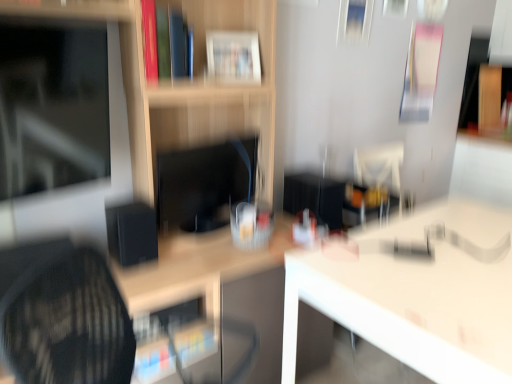
In order to face hardcover book at upper center, the first book in the left-to-right sequence, should I rotate leftwards or rightwards?

Turn left approximately 13.005 degrees to face it.

The width and height of the screenshot is (512, 384). What do you see at coordinates (182, 82) in the screenshot? I see `wooden shelf at center` at bounding box center [182, 82].

What do you see at coordinates (132, 233) in the screenshot?
I see `black matte speaker at center-left` at bounding box center [132, 233].

What do you see at coordinates (234, 56) in the screenshot?
I see `white glossy book at upper center, the 1th book in the right-to-left sequence` at bounding box center [234, 56].

This screenshot has width=512, height=384. I want to click on matte black monitor at left, which is the 2th computer monitor from back to front, so click(61, 131).

You are a GUI agent. You are given a task and a screenshot of the screen. Output one action in this format:
    pyautogui.click(x=<x>, y=<y>)
    Task: Click on the hardcover book at upper center, the first book in the left-to-right sequence
    This screenshot has width=512, height=384.
    Given the screenshot: What is the action you would take?
    pyautogui.click(x=166, y=42)

From the image's perspective, is hardcover book at upper center, arranged as the second book when viewed from the back, located beneath matte black monitor at center, the 1th computer monitor when ordered from right to left?

Actually, hardcover book at upper center, arranged as the second book when viewed from the back, appears above matte black monitor at center, the 1th computer monitor when ordered from right to left, in the image.

Is point (161, 10) farther from viewer compared to point (203, 196)?

No, it is not.

Does hardcover book at upper center, acting as the first book starting from the front, have a lesser height compared to matte black monitor at center, the 1th computer monitor when ordered from right to left?

Yes, hardcover book at upper center, acting as the first book starting from the front, is shorter than matte black monitor at center, the 1th computer monitor when ordered from right to left.

Is hardcover book at upper center, the first book in the left-to-right sequence, facing towards matte black monitor at center, which ranks as the second computer monitor in left-to-right order?

No, hardcover book at upper center, the first book in the left-to-right sequence, is not aimed at matte black monitor at center, which ranks as the second computer monitor in left-to-right order.

Is black matte speaker at center-left at the left side of matte black monitor at center, which ranks as the second computer monitor in left-to-right order?

Correct, you'll find black matte speaker at center-left to the left of matte black monitor at center, which ranks as the second computer monitor in left-to-right order.

Does black matte speaker at center-left come in front of matte black monitor at center, which ranks as the second computer monitor in left-to-right order?

That is False.

Considering the positions of point (140, 250) and point (227, 168), is point (140, 250) closer or farther from the camera than point (227, 168)?

Clearly, point (140, 250) is closer to the camera than point (227, 168).

Consider the image. From a real-world perspective, is black matte speaker at center-left over matte black monitor at center, which is the first computer monitor in back-to-front order?

Incorrect, from a real-world perspective, black matte speaker at center-left is lower than matte black monitor at center, which is the first computer monitor in back-to-front order.

Does white glossy table at center, which appears as the second table when viewed from the left, appear on the left side of black matte speaker at center-left?

No, white glossy table at center, which appears as the second table when viewed from the left, is not to the left of black matte speaker at center-left.

Based on the photo, considering the sizes of objects white glossy table at center, the first table from the right, and black matte speaker at center-left in the image provided, who is bigger, white glossy table at center, the first table from the right, or black matte speaker at center-left?

Bigger between the two is white glossy table at center, the first table from the right.

Is point (442, 228) farther from camera compared to point (155, 248)?

Yes, point (442, 228) is farther from viewer.

Is white glossy table at center, the first table from the right, aimed at black matte speaker at center-left?

No, white glossy table at center, the first table from the right, does not turn towards black matte speaker at center-left.

Is the position of hardcover book at upper center, the first book in the left-to-right sequence, more distant than that of matte black monitor at left, which ranks as the second computer monitor in right-to-left order?

Yes, hardcover book at upper center, the first book in the left-to-right sequence, is further from the camera.

From the image's perspective, who appears lower, hardcover book at upper center, positioned as the second book in right-to-left order, or matte black monitor at left, arranged as the 1th computer monitor when viewed from the left?

matte black monitor at left, arranged as the 1th computer monitor when viewed from the left, from the image's perspective.

Based on the photo, from a real-world perspective, which object stands above the other?

hardcover book at upper center, positioned as the second book in right-to-left order, from a real-world perspective.

Which of these two, hardcover book at upper center, the first book in the left-to-right sequence, or matte black monitor at left, which is the 2th computer monitor from back to front, stands shorter?

With less height is hardcover book at upper center, the first book in the left-to-right sequence.

What's the angular difference between black matte speaker at center-left and wooden shelf at center's facing directions?

The angular difference between black matte speaker at center-left and wooden shelf at center is 5.57 degrees.

From a real-world perspective, is black matte speaker at center-left under wooden shelf at center?

Yes, from a real-world perspective, black matte speaker at center-left is under wooden shelf at center.

Image resolution: width=512 pixels, height=384 pixels. I want to click on shelf in front of the black matte speaker at center-left, so click(x=182, y=82).

Is black matte speaker at center-left taller than wooden shelf at center?

No, black matte speaker at center-left is not taller than wooden shelf at center.

Is black matte speaker at center-left inside the boundaries of matte black monitor at left, which ranks as the second computer monitor in right-to-left order, or outside?

black matte speaker at center-left is outside matte black monitor at left, which ranks as the second computer monitor in right-to-left order.

In the scene shown: Which is in front, black matte speaker at center-left or matte black monitor at left, which is the 2th computer monitor from back to front?

matte black monitor at left, which is the 2th computer monitor from back to front.

Is black matte speaker at center-left bigger or smaller than matte black monitor at left, the 1th computer monitor from the front?

Clearly, black matte speaker at center-left is smaller in size than matte black monitor at left, the 1th computer monitor from the front.

Is black matte speaker at center-left looking in the opposite direction of matte black monitor at left, the 1th computer monitor from the front?

No.

From the image's perspective, is matte black monitor at left, which ranks as the second computer monitor in right-to-left order, located above or below white glossy book at upper center, marked as the 2th book in a left-to-right arrangement?

From the image's perspective, matte black monitor at left, which ranks as the second computer monitor in right-to-left order, appears below white glossy book at upper center, marked as the 2th book in a left-to-right arrangement.

From a real-world perspective, is matte black monitor at left, the 1th computer monitor from the front, located beneath white glossy book at upper center, the 1th book in the right-to-left sequence?

Correct, in the physical world, matte black monitor at left, the 1th computer monitor from the front, is lower than white glossy book at upper center, the 1th book in the right-to-left sequence.

Considering the sizes of objects matte black monitor at left, which is the 2th computer monitor from back to front, and white glossy book at upper center, the 1th book viewed from the back, in the image provided, who is bigger, matte black monitor at left, which is the 2th computer monitor from back to front, or white glossy book at upper center, the 1th book viewed from the back,?

With larger size is matte black monitor at left, which is the 2th computer monitor from back to front.

Looking at this image, between matte black monitor at left, which is the 2th computer monitor from back to front, and white glossy book at upper center, placed as the second book when sorted from front to back, which one has less height?

white glossy book at upper center, placed as the second book when sorted from front to back, is shorter.

From the image's perspective, starting from the hardcover book at upper center, acting as the first book starting from the front, which computer monitor is the 2nd one below? Please provide its 2D coordinates.

[(204, 184)]

The height and width of the screenshot is (384, 512). Find the location of `speaker below the matte black monitor at center, the 1th computer monitor when ordered from right to left (from a real-world perspective)`. speaker below the matte black monitor at center, the 1th computer monitor when ordered from right to left (from a real-world perspective) is located at coordinates (132, 233).

Considering their positions, is black matte speaker at center-left positioned further to hardcover book at upper center, arranged as the second book when viewed from the back, than matte black monitor at left, which is the 2th computer monitor from back to front?

Based on the image, black matte speaker at center-left appears to be further to hardcover book at upper center, arranged as the second book when viewed from the back.

Which object lies nearer to the anchor point wooden shelf at center, white glossy table at center, the first table from the right, or white glossy table at center, the 2th table in the right-to-left sequence?

white glossy table at center, the 2th table in the right-to-left sequence, lies closer to wooden shelf at center than the other object.

Based on the photo, considering their positions, is wooden shelf at center positioned further to white glossy table at center, the first table from the right, than white glossy table at center, the 2th table in the right-to-left sequence?

wooden shelf at center is further to white glossy table at center, the first table from the right.

Based on their spatial positions, is hardcover book at upper center, positioned as the second book in right-to-left order, or matte black monitor at center, which is the first computer monitor in back-to-front order, closer to white glossy table at center, the first table from the right?

Among the two, matte black monitor at center, which is the first computer monitor in back-to-front order, is located nearer to white glossy table at center, the first table from the right.

Which object lies further to the anchor point wooden shelf at center, matte black monitor at center, the 1th computer monitor when ordered from right to left, or black matte speaker at center-left?

black matte speaker at center-left is further to wooden shelf at center.

Which object lies further to the anchor point white glossy table at center, the 2th table in the right-to-left sequence, wooden shelf at center or black matte speaker at center-left?

The object further to white glossy table at center, the 2th table in the right-to-left sequence, is black matte speaker at center-left.

Estimate the real-world distances between objects in this image. Which object is further from matte black monitor at center, the 1th computer monitor when ordered from right to left, white glossy table at center, the first table from the right, or white glossy table at center, the 2th table in the right-to-left sequence?

The object further to matte black monitor at center, the 1th computer monitor when ordered from right to left, is white glossy table at center, the first table from the right.

Which object lies nearer to the anchor point white glossy table at center, the 2th table in the right-to-left sequence, matte black monitor at center, which ranks as the second computer monitor in left-to-right order, or wooden shelf at center?

Based on the image, wooden shelf at center appears to be nearer to white glossy table at center, the 2th table in the right-to-left sequence.

Locate an element on the screen. This screenshot has height=384, width=512. shelf situated between hardcover book at upper center, the first book in the left-to-right sequence, and white glossy table at center, which appears as the second table when viewed from the left, from left to right is located at coordinates (182, 82).

The image size is (512, 384). What are the coordinates of `table between wooden shelf at center and white glossy table at center, which appears as the second table when viewed from the left, from left to right` in the screenshot? It's located at (211, 304).

Where is `shelf between black matte speaker at center-left and white glossy table at center, the first table from the right, from left to right`? This screenshot has height=384, width=512. shelf between black matte speaker at center-left and white glossy table at center, the first table from the right, from left to right is located at coordinates pos(182,82).

Where is `shelf between hardcover book at upper center, positioned as the second book in right-to-left order, and black matte speaker at center-left from top to bottom`? The width and height of the screenshot is (512, 384). shelf between hardcover book at upper center, positioned as the second book in right-to-left order, and black matte speaker at center-left from top to bottom is located at coordinates (182, 82).